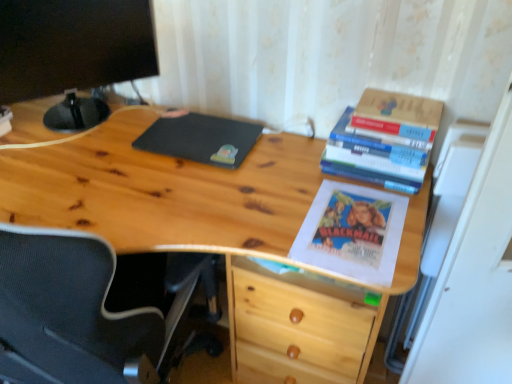
In order to face hardcover book at upper right, which is the second book in bottom-to-top order, should I rotate leftwards or rightwards?

Turn right approximately 18.325 degrees to face it.

What do you see at coordinates (156, 188) in the screenshot?
I see `natural wood desk at center` at bounding box center [156, 188].

You are a GUI agent. You are given a task and a screenshot of the screen. Output one action in this format:
    pyautogui.click(x=<x>, y=<y>)
    Task: Click on the black matte computer monitor at upper left
    The image size is (512, 384).
    Given the screenshot: What is the action you would take?
    pyautogui.click(x=73, y=45)

Is there a large distance between black matte computer monitor at upper left and natural wood desk at center?

Actually, black matte computer monitor at upper left and natural wood desk at center are a little close together.

Considering the relative positions of black matte computer monitor at upper left and natural wood desk at center in the image provided, is black matte computer monitor at upper left to the right of natural wood desk at center from the viewer's perspective?

In fact, black matte computer monitor at upper left is to the left of natural wood desk at center.

Can you confirm if black matte computer monitor at upper left is bigger than natural wood desk at center?

Incorrect, black matte computer monitor at upper left is not larger than natural wood desk at center.

Is natural wood desk at center completely or partially inside black matte computer monitor at upper left?

No, natural wood desk at center is not inside black matte computer monitor at upper left.

Considering the sizes of objects natural wood desk at center and hardcover books at upper right, the 1th book when ordered from bottom to top, in the image provided, who is shorter, natural wood desk at center or hardcover books at upper right, the 1th book when ordered from bottom to top,?

hardcover books at upper right, the 1th book when ordered from bottom to top.

Do you think natural wood desk at center is within hardcover books at upper right, acting as the 2th book starting from the top, or outside of it?

natural wood desk at center is not inside hardcover books at upper right, acting as the 2th book starting from the top, it's outside.

Considering the sizes of objects natural wood desk at center and hardcover books at upper right, the 1th book when ordered from bottom to top, in the image provided, who is smaller, natural wood desk at center or hardcover books at upper right, the 1th book when ordered from bottom to top,?

Smaller between the two is hardcover books at upper right, the 1th book when ordered from bottom to top.

Would you say natural wood desk at center is a long distance from hardcover books at upper right, the 1th book when ordered from bottom to top?

natural wood desk at center is actually quite close to hardcover books at upper right, the 1th book when ordered from bottom to top.

Looking at this image, measure the distance between hardcover book at upper right, which appears as the first book when viewed from the top, and hardcover books at upper right, acting as the 2th book starting from the top.

They are 2.13 inches apart.

Can you confirm if hardcover book at upper right, which appears as the first book when viewed from the top, is taller than hardcover books at upper right, acting as the 2th book starting from the top?

Incorrect, the height of hardcover book at upper right, which appears as the first book when viewed from the top, is not larger of that of hardcover books at upper right, acting as the 2th book starting from the top.

Which of these two, hardcover book at upper right, which appears as the first book when viewed from the top, or hardcover books at upper right, acting as the 2th book starting from the top, is wider?

hardcover books at upper right, acting as the 2th book starting from the top.

Which object is positioned more to the left, black matte mousepad at center or natural wood desk at center?

natural wood desk at center.

Can you confirm if black matte mousepad at center is taller than natural wood desk at center?

Incorrect, the height of black matte mousepad at center is not larger of that of natural wood desk at center.

Is black matte mousepad at center not within natural wood desk at center?

That's incorrect, black matte mousepad at center is not completely outside natural wood desk at center.

Is black matte mousepad at center not close to natural wood desk at center?

black matte mousepad at center is near natural wood desk at center, not far away.

Is black matte computer monitor at upper left smaller than hardcover books at upper right, acting as the 2th book starting from the top?

No.

Measure the distance between black matte computer monitor at upper left and hardcover books at upper right, acting as the 2th book starting from the top.

A distance of 30.23 inches exists between black matte computer monitor at upper left and hardcover books at upper right, acting as the 2th book starting from the top.

Can you confirm if black matte computer monitor at upper left is shorter than hardcover books at upper right, acting as the 2th book starting from the top?

Incorrect, the height of black matte computer monitor at upper left does not fall short of that of hardcover books at upper right, acting as the 2th book starting from the top.

From the image's perspective, which is above, black matte computer monitor at upper left or hardcover books at upper right, the 1th book when ordered from bottom to top?

black matte computer monitor at upper left, from the image's perspective.

From the image's perspective, is natural wood desk at center under black matte computer monitor at upper left?

Indeed, from the image's perspective, natural wood desk at center is shown beneath black matte computer monitor at upper left.

Which of these two, natural wood desk at center or black matte computer monitor at upper left, stands taller?

natural wood desk at center is taller.

Looking at this image, can black matte computer monitor at upper left be found inside natural wood desk at center?

No, black matte computer monitor at upper left is not inside natural wood desk at center.

Is natural wood desk at center wider or thinner than black matte computer monitor at upper left?

Clearly, natural wood desk at center has more width compared to black matte computer monitor at upper left.

Is hardcover books at upper right, the 1th book when ordered from bottom to top, turned away from black matte computer monitor at upper left?

That's not correct — hardcover books at upper right, the 1th book when ordered from bottom to top, is not looking away from black matte computer monitor at upper left.

Is hardcover books at upper right, the 1th book when ordered from bottom to top, to the left or to the right of black matte computer monitor at upper left in the image?

Based on their positions, hardcover books at upper right, the 1th book when ordered from bottom to top, is located to the right of black matte computer monitor at upper left.

Between hardcover books at upper right, the 1th book when ordered from bottom to top, and black matte computer monitor at upper left, which one has less height?

Standing shorter between the two is hardcover books at upper right, the 1th book when ordered from bottom to top.

From the image's perspective, is hardcover books at upper right, the 1th book when ordered from bottom to top, below black matte computer monitor at upper left?

Yes, from the image's perspective, hardcover books at upper right, the 1th book when ordered from bottom to top, is below black matte computer monitor at upper left.

Where is `computer monitor above the natural wood desk at center (from a real-world perspective)`? computer monitor above the natural wood desk at center (from a real-world perspective) is located at coordinates (73, 45).

The image size is (512, 384). In order to click on desk located in front of the hardcover books at upper right, the 1th book when ordered from bottom to top in this screenshot , I will do `click(156, 188)`.

Based on their spatial positions, is black matte computer monitor at upper left or black matte mousepad at center closer to hardcover book at upper right, which is the second book in bottom-to-top order?

Based on the image, black matte mousepad at center appears to be nearer to hardcover book at upper right, which is the second book in bottom-to-top order.

Looking at the image, which one is located further to hardcover books at upper right, the 1th book when ordered from bottom to top, black matte computer monitor at upper left or hardcover book at upper right, which is the second book in bottom-to-top order?

black matte computer monitor at upper left lies further to hardcover books at upper right, the 1th book when ordered from bottom to top, than the other object.

Considering their positions, is black matte mousepad at center positioned closer to hardcover book at upper right, which appears as the first book when viewed from the top, than natural wood desk at center?

The object closer to hardcover book at upper right, which appears as the first book when viewed from the top, is black matte mousepad at center.

Considering their positions, is hardcover books at upper right, the 1th book when ordered from bottom to top, positioned closer to black matte mousepad at center than hardcover book at upper right, which is the second book in bottom-to-top order?

The object closer to black matte mousepad at center is hardcover books at upper right, the 1th book when ordered from bottom to top.

When comparing their distances from black matte computer monitor at upper left, does hardcover book at upper right, which is the second book in bottom-to-top order, or natural wood desk at center seem further?

The object further to black matte computer monitor at upper left is hardcover book at upper right, which is the second book in bottom-to-top order.

When comparing their distances from natural wood desk at center, does black matte mousepad at center or hardcover book at upper right, which is the second book in bottom-to-top order, seem further?

Among the two, hardcover book at upper right, which is the second book in bottom-to-top order, is located further to natural wood desk at center.

Estimate the real-world distances between objects in this image. Which object is further from hardcover books at upper right, the 1th book when ordered from bottom to top, black matte mousepad at center or natural wood desk at center?

Based on the image, black matte mousepad at center appears to be further to hardcover books at upper right, the 1th book when ordered from bottom to top.

Looking at the image, which one is located closer to natural wood desk at center, black matte mousepad at center or hardcover books at upper right, acting as the 2th book starting from the top?

black matte mousepad at center lies closer to natural wood desk at center than the other object.

Where is `desk between black matte computer monitor at upper left and hardcover book at upper right, which is the second book in bottom-to-top order, in the horizontal direction`? desk between black matte computer monitor at upper left and hardcover book at upper right, which is the second book in bottom-to-top order, in the horizontal direction is located at coordinates (156, 188).

This screenshot has height=384, width=512. In order to click on book between black matte mousepad at center and hardcover book at upper right, which is the second book in bottom-to-top order in this screenshot , I will do `click(384, 140)`.

Find the location of a particular element. Image resolution: width=512 pixels, height=384 pixels. notebook situated between natural wood desk at center and hardcover books at upper right, acting as the 2th book starting from the top, from left to right is located at coordinates (201, 139).

This screenshot has height=384, width=512. Find the location of `book between black matte computer monitor at upper left and hardcover book at upper right, which is the second book in bottom-to-top order, from left to right`. book between black matte computer monitor at upper left and hardcover book at upper right, which is the second book in bottom-to-top order, from left to right is located at coordinates (384, 140).